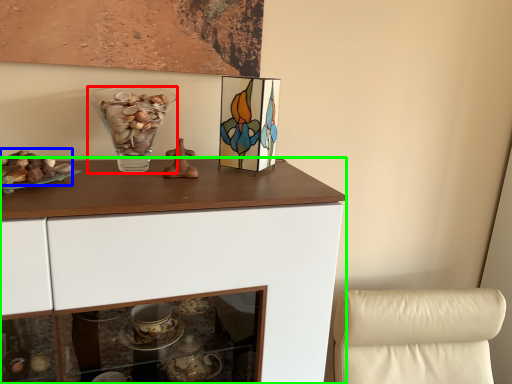
Question: Which is nearer to the vase (highlighted by a red box)? stuff (highlighted by a blue box) or cabinetry (highlighted by a green box).

Choices:
 (A) stuff
 (B) cabinetry

Answer: (A)